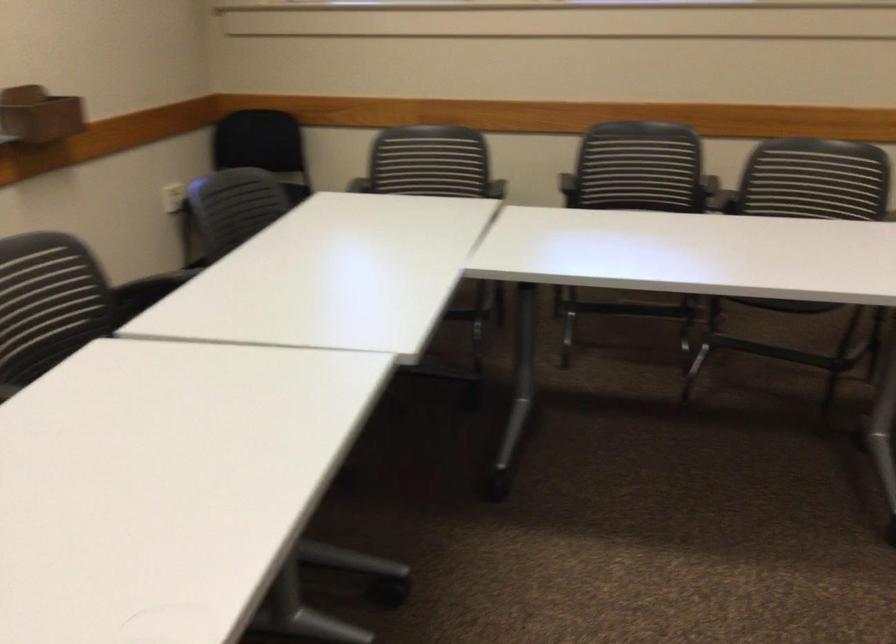
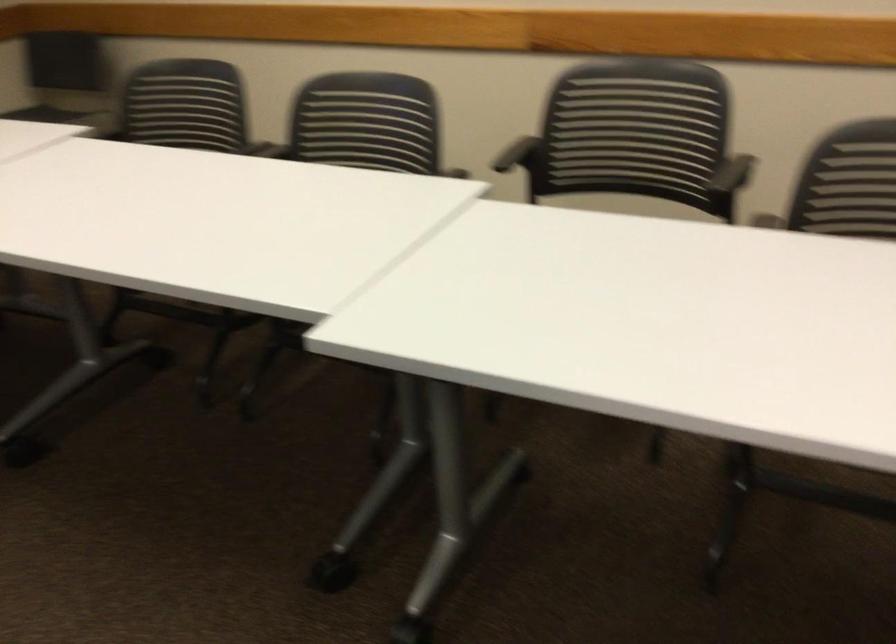
First-person continuous shooting, in which direction is the camera rotating?

The camera rotated toward right-down.